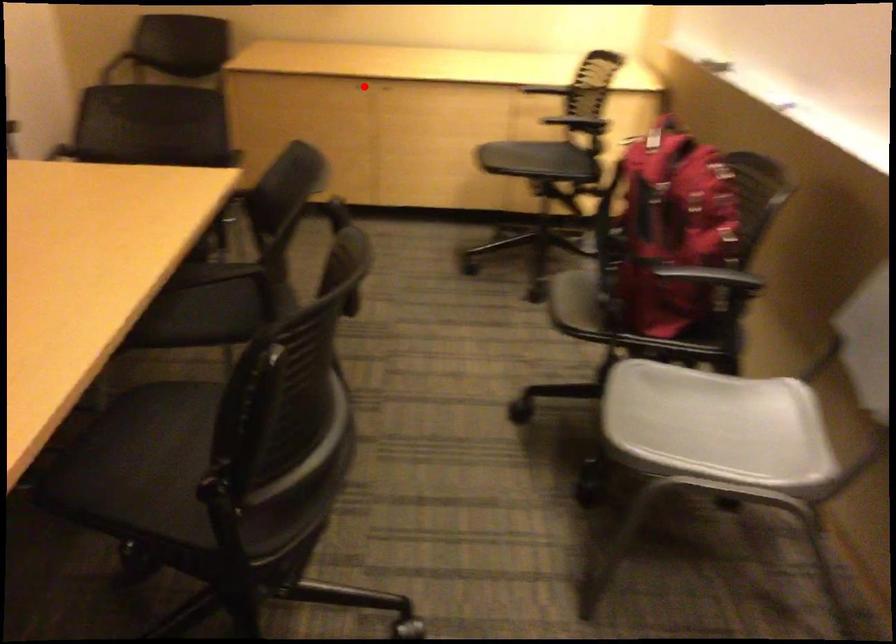
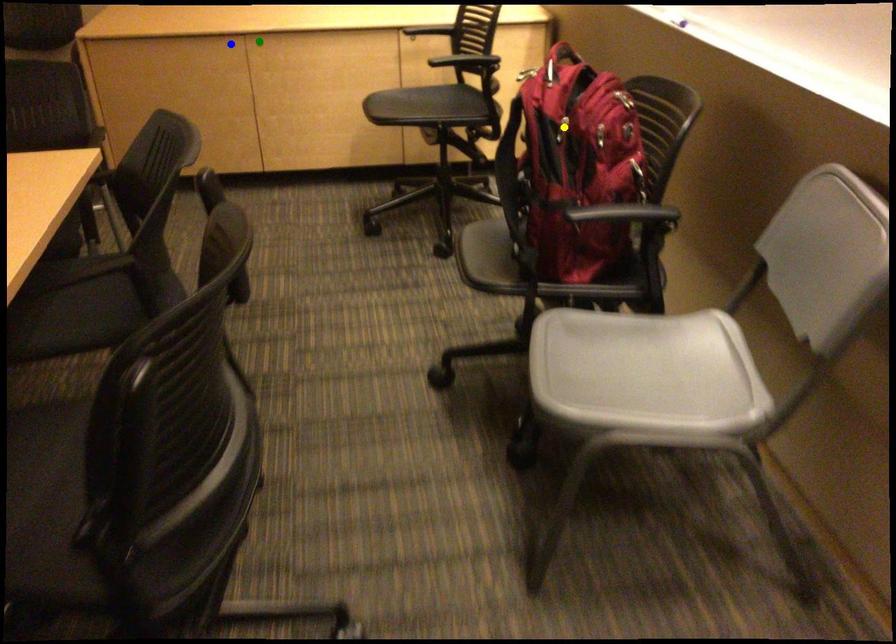
Question: I am providing you with two images of the same scene from different viewpoints. A red point is marked on the first image. You are given multiple points on the second image. Which point in image 2 represents the same 3d spot as the red point in image 1?

Choices:
 (A) yellow point
 (B) green point
 (C) blue point

Answer: (C)